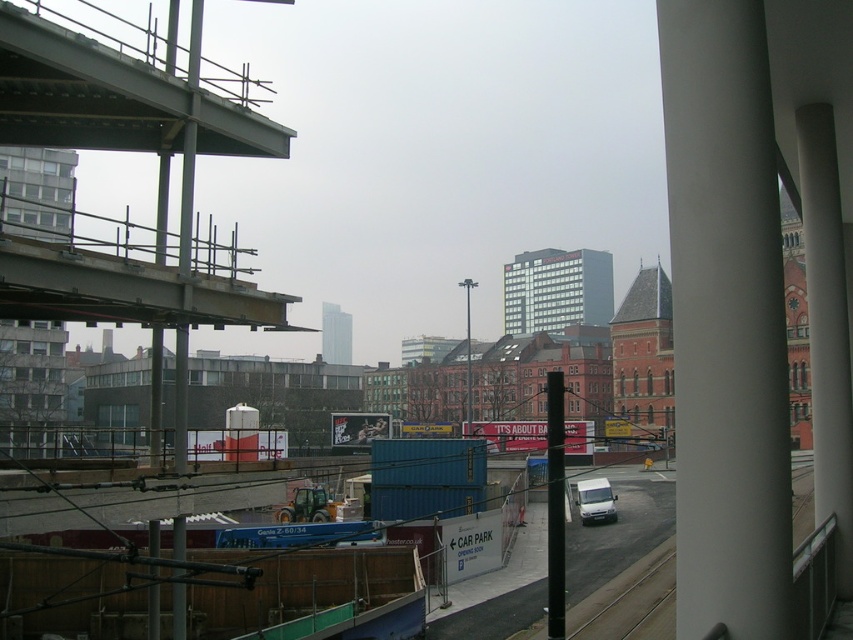
Question: Among these points, which one is nearest to the camera?

Choices:
 (A) (16, 77)
 (B) (589, 508)
 (C) (665, 598)

Answer: (A)

Question: Which of these objects is positioned farthest from the white matte van at center?

Choices:
 (A) gray metallic overpass at upper left
 (B) gray concrete train track at lower center

Answer: (A)

Question: Can you confirm if gray concrete train track at lower center is bigger than white matte van at center?

Choices:
 (A) yes
 (B) no

Answer: (A)

Question: Which object is closer to the camera taking this photo?

Choices:
 (A) gray metallic overpass at upper left
 (B) gray concrete train track at lower center

Answer: (A)

Question: Does gray concrete train track at lower center come behind white matte van at center?

Choices:
 (A) yes
 (B) no

Answer: (B)

Question: Does gray metallic overpass at upper left appear under gray concrete train track at lower center?

Choices:
 (A) no
 (B) yes

Answer: (A)